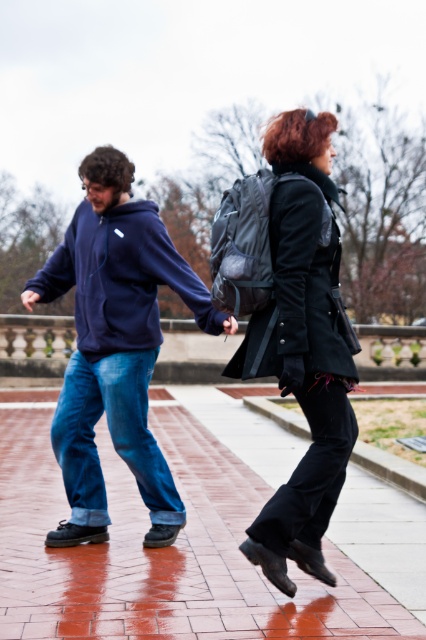
Question: Is matte blue hoodie at center further to the viewer compared to black matte jacket at upper right?

Choices:
 (A) no
 (B) yes

Answer: (B)

Question: Which object is positioned farthest from the matte blue hoodie at center?

Choices:
 (A) brick pavement at center
 (B) navy fleece jacket at left
 (C) black matte jacket at upper right
 (D) matte black coat at center

Answer: (A)

Question: Which of the following is the farthest from the observer?

Choices:
 (A) matte black coat at center
 (B) black matte jacket at upper right
 (C) matte blue hoodie at center
 (D) brick pavement at center

Answer: (D)

Question: Which is nearer to the matte blue hoodie at center?

Choices:
 (A) matte black coat at center
 (B) black matte jacket at upper right
 (C) navy fleece jacket at left
 (D) brick pavement at center

Answer: (C)

Question: Does brick pavement at center appear under black matte jacket at upper right?

Choices:
 (A) yes
 (B) no

Answer: (A)

Question: Can you confirm if matte black coat at center is positioned above navy fleece jacket at left?

Choices:
 (A) yes
 (B) no

Answer: (B)